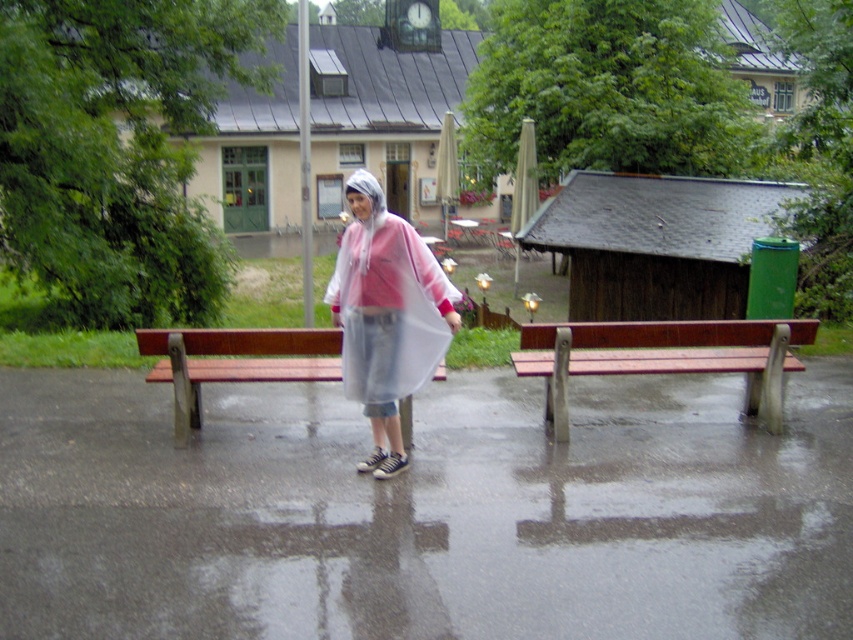
Question: Based on their relative distances, which object is farther from the wooden bench at right?

Choices:
 (A) brown wooden bench at left
 (B) transparent plastic poncho at center

Answer: (A)

Question: Is transparent plastic poncho at center below wooden bench at right?

Choices:
 (A) no
 (B) yes

Answer: (B)

Question: Which point is farther from the camera taking this photo?

Choices:
 (A) (561, 330)
 (B) (405, 408)
 (C) (410, 304)

Answer: (B)

Question: Is wooden bench at right above brown wooden bench at left?

Choices:
 (A) no
 (B) yes

Answer: (B)

Question: Is the position of transparent plastic poncho at center less distant than that of brown wooden bench at left?

Choices:
 (A) yes
 (B) no

Answer: (A)

Question: Estimate the real-world distances between objects in this image. Which object is farther from the transparent plastic poncho at center?

Choices:
 (A) brown wooden bench at left
 (B) wooden bench at right

Answer: (B)